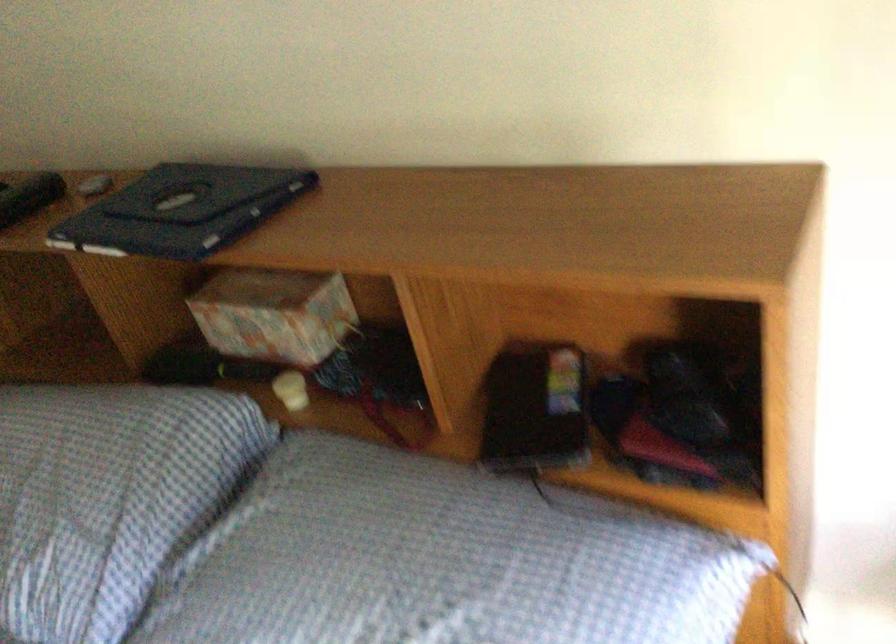
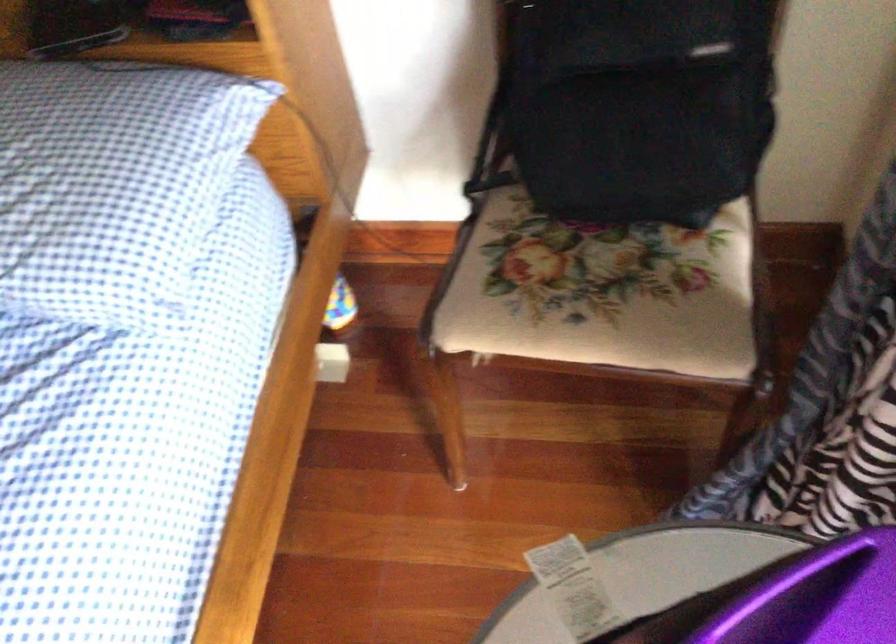
How did the camera likely rotate?

The camera rotated toward right-down.